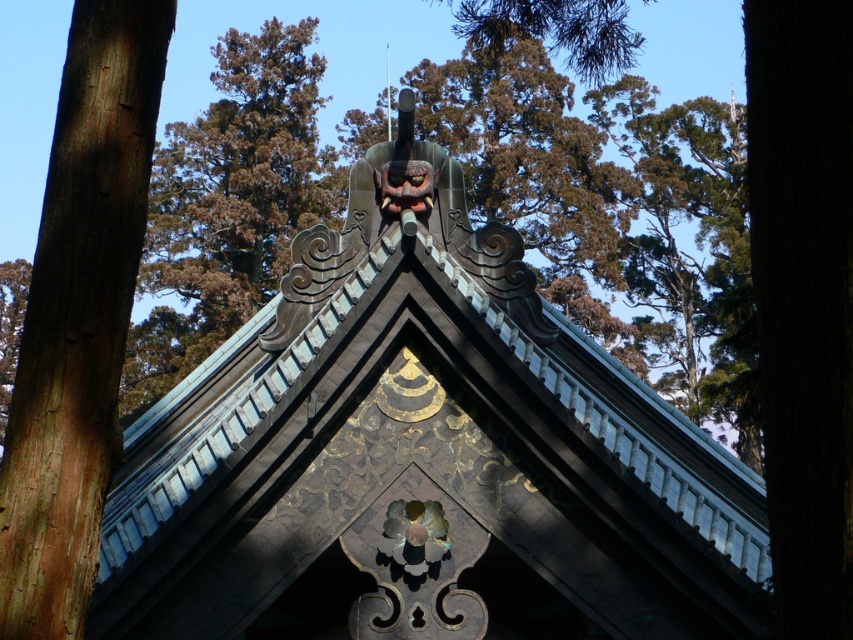
Who is shorter, brown rough wood at left or brown wood tree at upper center?

brown rough wood at left is shorter.

Who is lower down, brown rough wood at left or brown wood tree at upper center?

brown rough wood at left

Who is more distant from viewer, [96,422] or [222,289]?

The point [222,289] is more distant.

The image size is (853, 640). Find the location of `brown rough wood at left`. brown rough wood at left is located at coordinates (78, 316).

Is point (44, 589) closer to camera compared to point (828, 257)?

No, (44, 589) is behind (828, 257).

Is brown rough wood at left above dark brown wood at right?

No, brown rough wood at left is not above dark brown wood at right.

I want to click on brown rough wood at left, so click(x=78, y=316).

What are the coordinates of `brown rough wood at left` in the screenshot? It's located at (78, 316).

Does point (827, 323) come farther from viewer compared to point (210, 252)?

That is False.

The image size is (853, 640). I want to click on dark brown wood at right, so click(804, 298).

The image size is (853, 640). I want to click on dark brown wood at right, so click(804, 298).

Find the location of a particular element. This screenshot has width=853, height=640. dark brown wood at right is located at coordinates (804, 298).